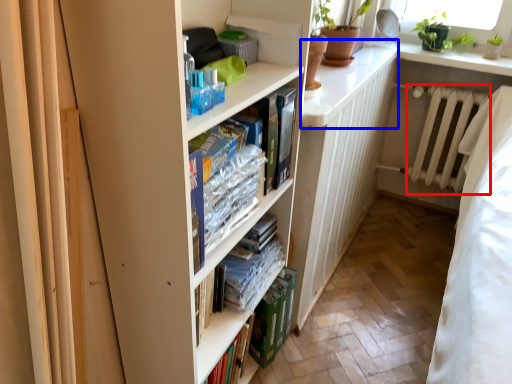
Question: Among these objects, which one is nearest to the camera, radiator (highlighted by a red box) or counter top (highlighted by a blue box)?

Choices:
 (A) radiator
 (B) counter top

Answer: (B)